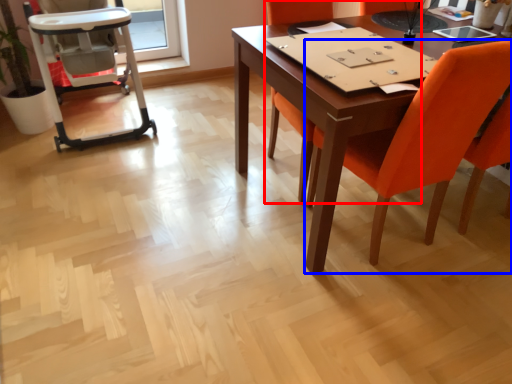
Question: Which point is closer to the camera, chair (highlighted by a red box) or chair (highlighted by a blue box)?

Choices:
 (A) chair
 (B) chair

Answer: (B)